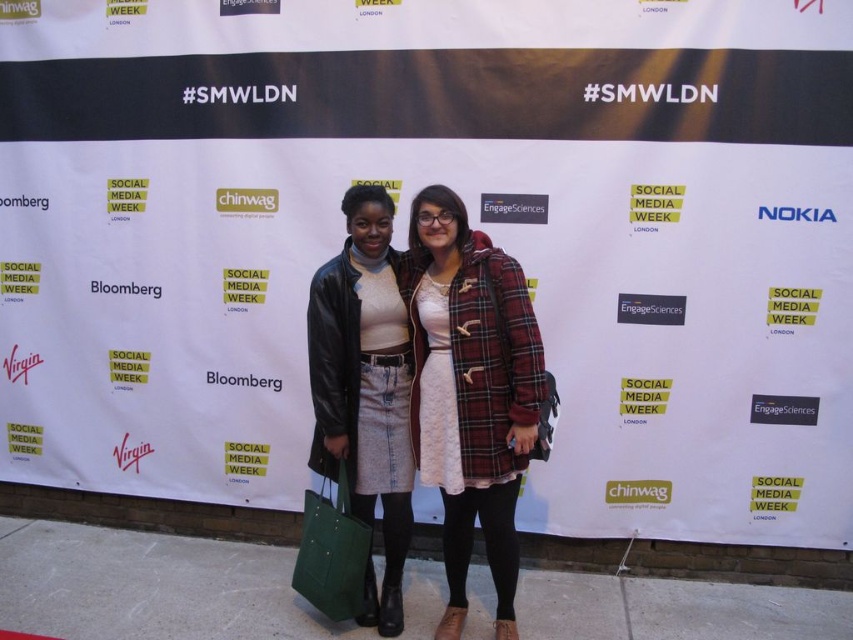
You are standing in front of the Social Media Week London backdrop. You see a point at coordinates (469,392). Which object from the scene is this point located on?

The point at coordinates (469,392) is located on the plaid wool coat at center.

Based on the photo, you are a photographer at the event and need to adjust the lighting so that both the matte black jacket at center and the green fabric tote at lower center are evenly illuminated. Considering their positions, how far apart are these two items?

The matte black jacket at center is 27.45 centimeters away from the green fabric tote at lower center, so the photographer should ensure the lighting setup accounts for this distance to evenly illuminate both items.